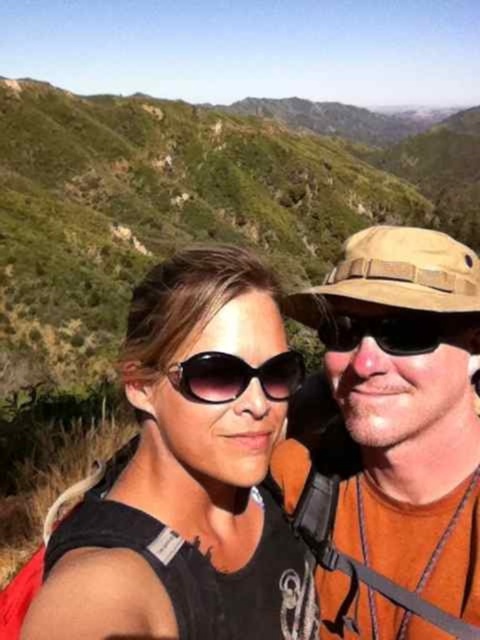
You are a photographer trying to capture a closeup of the brown canvas hat at upper right and the matte black sunglasses at center. Since you want both items to appear equally prominent in the photo, which object should you zoom in on more?

The brown canvas hat at upper right is larger in size than matte black sunglasses at center, so you should zoom in more on the matte black sunglasses at center to make both appear equally prominent in the photo.